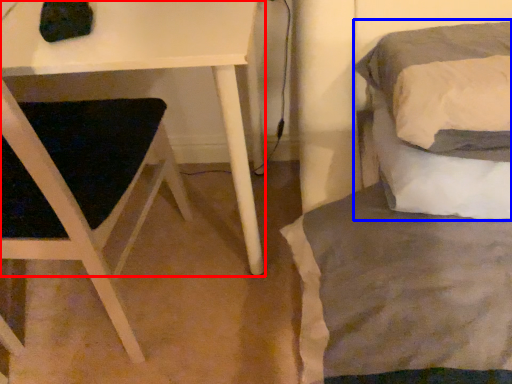
Question: Among these objects, which one is farthest to the camera, table (highlighted by a red box) or bed (highlighted by a blue box)?

Choices:
 (A) table
 (B) bed

Answer: (A)